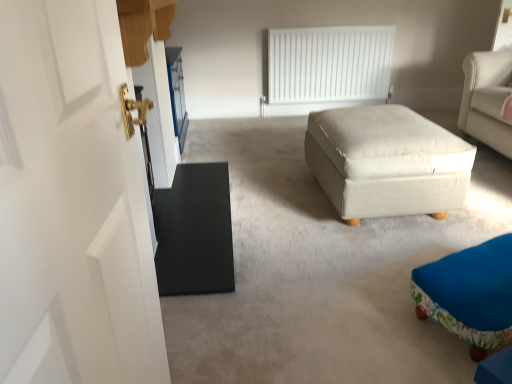
Question: Should I look upward or downward to see black matte door at left?

Choices:
 (A) up
 (B) down

Answer: (A)

Question: Can you confirm if black matte door at left is bigger than white fabric ottoman at center, positioned as the first table in right-to-left order?

Choices:
 (A) no
 (B) yes

Answer: (B)

Question: Is black matte door at left beside white fabric ottoman at center, positioned as the first table in right-to-left order?

Choices:
 (A) no
 (B) yes

Answer: (A)

Question: Would you say black matte door at left contains white fabric ottoman at center, positioned as the first table in right-to-left order?

Choices:
 (A) no
 (B) yes

Answer: (A)

Question: From a real-world perspective, is black matte door at left on top of white fabric ottoman at center, positioned as the first table in right-to-left order?

Choices:
 (A) no
 (B) yes

Answer: (A)

Question: From a real-world perspective, is black matte door at left positioned under white fabric ottoman at center, marked as the 2th table in a left-to-right arrangement, based on gravity?

Choices:
 (A) yes
 (B) no

Answer: (A)

Question: Is black matte door at left positioned beyond the bounds of white fabric ottoman at center, marked as the 2th table in a left-to-right arrangement?

Choices:
 (A) yes
 (B) no

Answer: (A)

Question: From a real-world perspective, is white fabric ottoman at center, positioned as the first table in right-to-left order, below black matte table at left, marked as the first table in a left-to-right arrangement?

Choices:
 (A) no
 (B) yes

Answer: (A)

Question: Does white fabric ottoman at center, marked as the 2th table in a left-to-right arrangement, have a larger size compared to black matte table at left, marked as the first table in a left-to-right arrangement?

Choices:
 (A) yes
 (B) no

Answer: (A)

Question: Can you confirm if white fabric ottoman at center, positioned as the first table in right-to-left order, is shorter than black matte table at left, the 2th table when ordered from right to left?

Choices:
 (A) yes
 (B) no

Answer: (B)

Question: Can you confirm if white fabric ottoman at center, positioned as the first table in right-to-left order, is smaller than black matte table at left, marked as the first table in a left-to-right arrangement?

Choices:
 (A) no
 (B) yes

Answer: (A)

Question: From the image's perspective, is white fabric ottoman at center, marked as the 2th table in a left-to-right arrangement, on black matte table at left, marked as the first table in a left-to-right arrangement?

Choices:
 (A) yes
 (B) no

Answer: (A)

Question: Are white fabric ottoman at center, marked as the 2th table in a left-to-right arrangement, and black matte table at left, the 2th table when ordered from right to left, located far from each other?

Choices:
 (A) yes
 (B) no

Answer: (B)

Question: From a real-world perspective, is white matte radiator at upper center physically below black matte door at left?

Choices:
 (A) yes
 (B) no

Answer: (B)